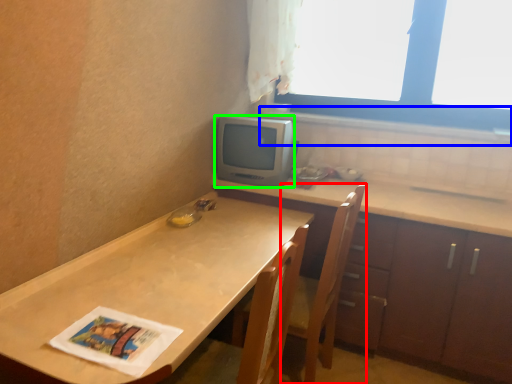
Question: Which object is positioned closest to chair (highlighted by a red box)? Select from window sill (highlighted by a blue box) and appliance (highlighted by a green box).

Choices:
 (A) window sill
 (B) appliance

Answer: (B)